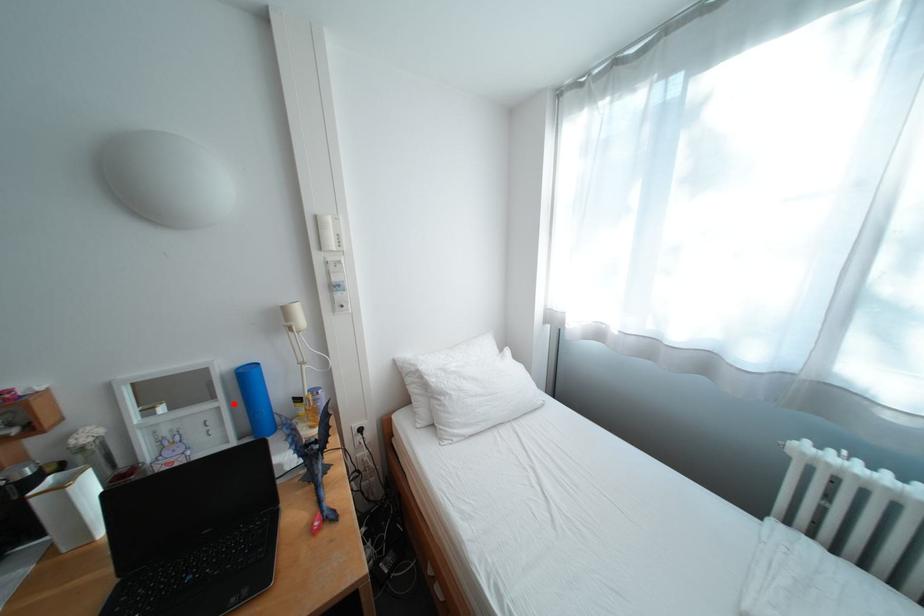
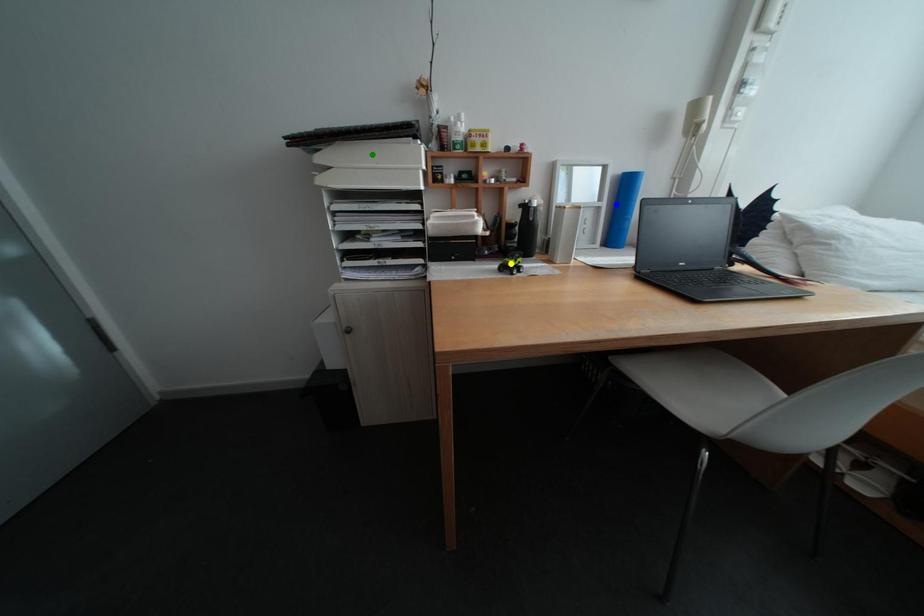
Question: I am providing you with two images of the same scene from different viewpoints. A red point is marked on the first image. You are given multiple points on the second image. Which spot in image 2 lines up with the point in image 1?

Choices:
 (A) blue point
 (B) yellow point
 (C) green point

Answer: (A)